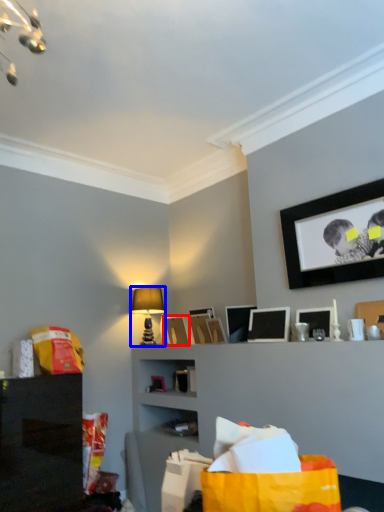
Question: Which of the following is the closest to the observer, picture frame (highlighted by a red box) or table lamp (highlighted by a blue box)?

Choices:
 (A) picture frame
 (B) table lamp

Answer: (A)